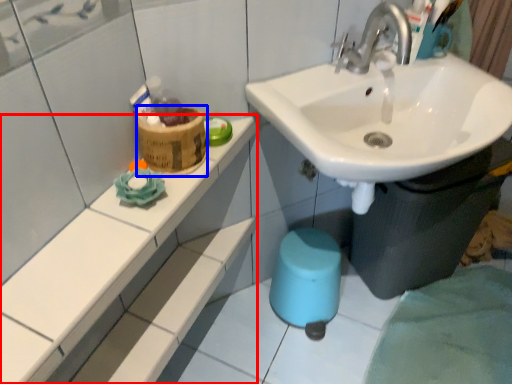
Question: Which of the following is the farthest to the observer, counter top (highlighted by a red box) or potty (highlighted by a blue box)?

Choices:
 (A) counter top
 (B) potty

Answer: (B)